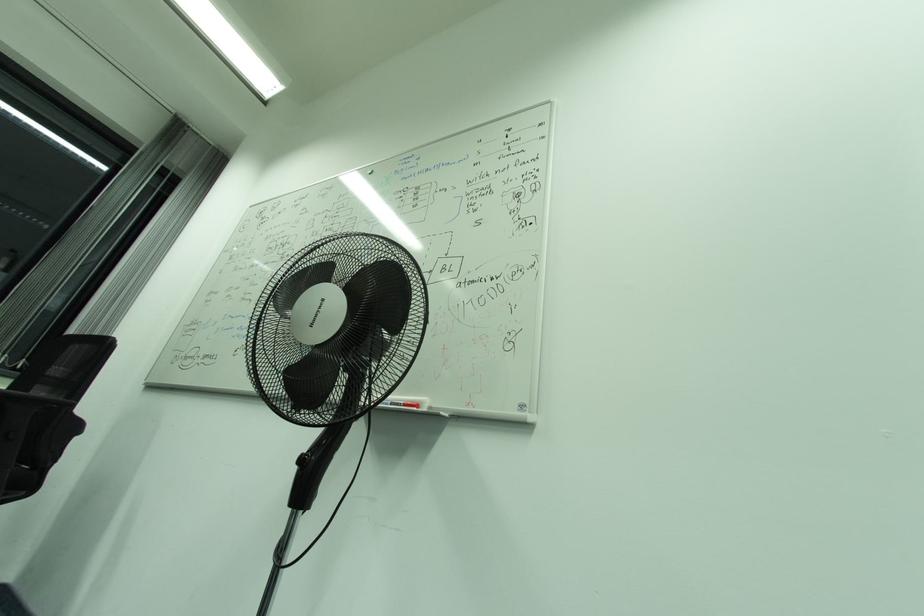
Identify the location of fan control panel. (314, 458).